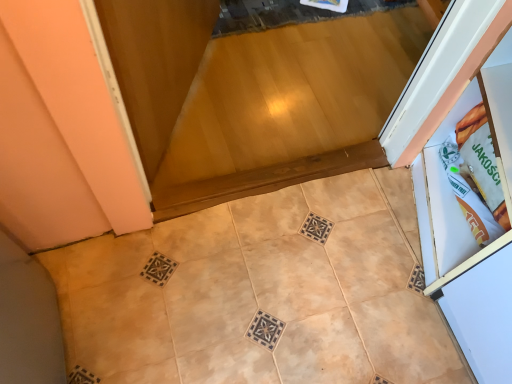
Question: Should I look upward or downward to see beige matte tile at center, the second ceramic tile when ordered from right to left?

Choices:
 (A) up
 (B) down

Answer: (B)

Question: Does beige matte tile at lower left, the 2th ceramic tile in the left-to-right sequence, come behind beige matte tile at center, the second ceramic tile when ordered from right to left?

Choices:
 (A) yes
 (B) no

Answer: (B)

Question: From a real-world perspective, is beige matte tile at lower left, the 1th ceramic tile viewed from the right, below beige matte tile at center, placed as the first ceramic tile when sorted from left to right?

Choices:
 (A) no
 (B) yes

Answer: (A)

Question: From the image's perspective, is beige matte tile at lower left, the 2th ceramic tile in the left-to-right sequence, on top of beige matte tile at center, placed as the first ceramic tile when sorted from left to right?

Choices:
 (A) no
 (B) yes

Answer: (B)

Question: Is beige matte tile at lower left, the 1th ceramic tile viewed from the right, taller than beige matte tile at center, placed as the first ceramic tile when sorted from left to right?

Choices:
 (A) yes
 (B) no

Answer: (A)

Question: Is beige matte tile at lower left, the 2th ceramic tile in the left-to-right sequence, not within beige matte tile at center, the second ceramic tile when ordered from right to left?

Choices:
 (A) no
 (B) yes

Answer: (B)

Question: Does beige matte tile at lower left, the 1th ceramic tile viewed from the right, have a greater width compared to beige matte tile at center, the second ceramic tile when ordered from right to left?

Choices:
 (A) no
 (B) yes

Answer: (B)

Question: Does beige matte tile at center, placed as the first ceramic tile when sorted from left to right, have a lesser width compared to beige matte tile at lower left, the 1th ceramic tile viewed from the right?

Choices:
 (A) yes
 (B) no

Answer: (A)

Question: Is beige matte tile at center, the second ceramic tile when ordered from right to left, outside of beige matte tile at lower left, the 1th ceramic tile viewed from the right?

Choices:
 (A) no
 (B) yes

Answer: (A)

Question: Is beige matte tile at center, placed as the first ceramic tile when sorted from left to right, wider than beige matte tile at lower left, the 2th ceramic tile in the left-to-right sequence?

Choices:
 (A) yes
 (B) no

Answer: (B)

Question: Could you tell me if beige matte tile at center, placed as the first ceramic tile when sorted from left to right, is turned towards beige matte tile at lower left, the 1th ceramic tile viewed from the right?

Choices:
 (A) yes
 (B) no

Answer: (A)

Question: Is beige matte tile at center, the second ceramic tile when ordered from right to left, smaller than beige matte tile at lower left, the 2th ceramic tile in the left-to-right sequence?

Choices:
 (A) no
 (B) yes

Answer: (B)

Question: Is beige matte tile at center, placed as the first ceramic tile when sorted from left to right, to the left of beige matte tile at lower left, the 1th ceramic tile viewed from the right, from the viewer's perspective?

Choices:
 (A) no
 (B) yes

Answer: (B)

Question: In terms of width, does beige matte tile at lower left, the 2th ceramic tile in the left-to-right sequence, look wider or thinner when compared to beige matte tile at center, the second ceramic tile when ordered from right to left?

Choices:
 (A) thin
 (B) wide

Answer: (B)